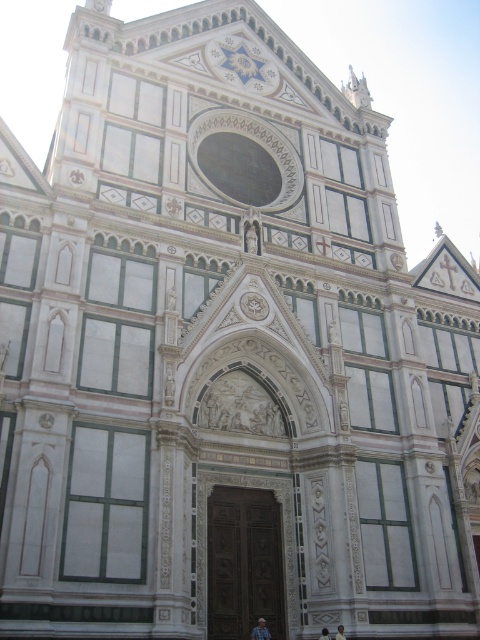
Question: Which object appears closest to the camera in this image?

Choices:
 (A) light brown leather jacket at lower center
 (B) light blue denim jeans at lower center

Answer: (A)

Question: From the image, what is the correct spatial relationship of light blue denim jeans at lower center in relation to light brown leather jacket at lower center?

Choices:
 (A) below
 (B) above

Answer: (A)

Question: Does light brown leather jacket at lower center have a smaller size compared to light brown wooden door at center?

Choices:
 (A) no
 (B) yes

Answer: (B)

Question: Which object appears closest to the camera in this image?

Choices:
 (A) light brown wooden door at center
 (B) light brown leather jacket at lower center

Answer: (B)

Question: Which point is closer to the camera?

Choices:
 (A) light brown wooden door at center
 (B) light brown leather jacket at lower center
 (C) light blue denim jeans at lower center

Answer: (B)

Question: Considering the relative positions of light brown leather jacket at lower center and light brown wooden door at center in the image provided, where is light brown leather jacket at lower center located with respect to light brown wooden door at center?

Choices:
 (A) above
 (B) below

Answer: (A)